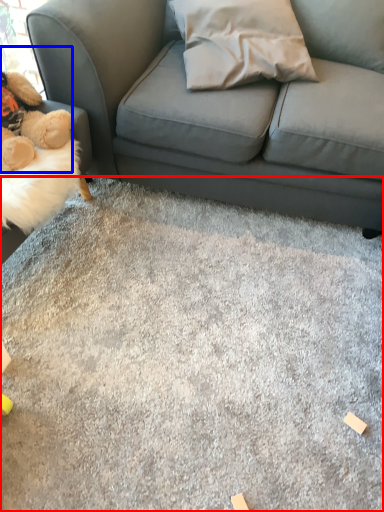
Question: Among these objects, which one is farthest to the camera, concrete (highlighted by a red box) or toy (highlighted by a blue box)?

Choices:
 (A) concrete
 (B) toy

Answer: (B)